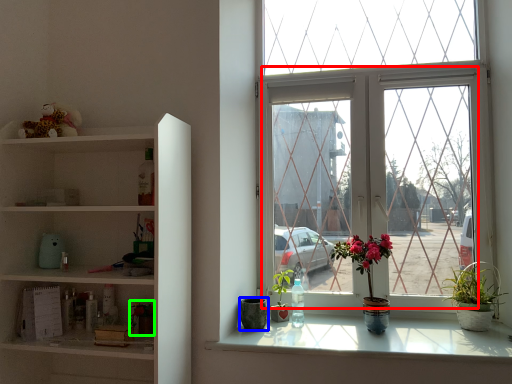
Question: Which object is the closest to the glass window (highlighted by a red box)? Choose among these: flowerpot (highlighted by a blue box) or houseplant (highlighted by a green box).

Choices:
 (A) flowerpot
 (B) houseplant

Answer: (A)